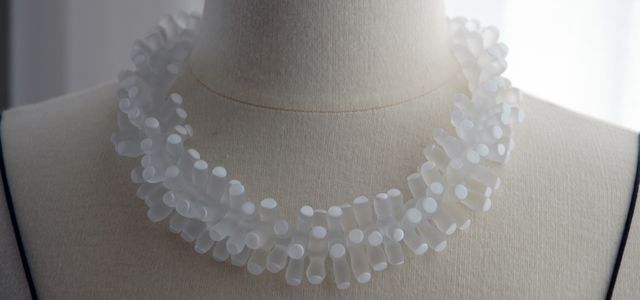
Find the location of a particular element. The height and width of the screenshot is (300, 640). curtain is located at coordinates (610, 76).